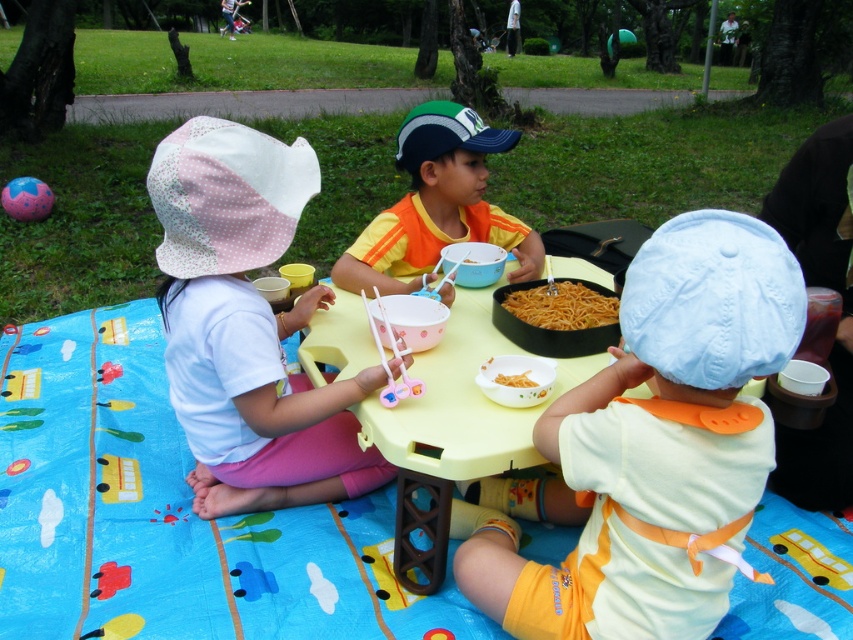
Based on the photo, does blue fabric picnic blanket at center have a greater height compared to yellow plastic table at center?

Indeed, blue fabric picnic blanket at center has a greater height compared to yellow plastic table at center.

Find the location of `blue fabric picnic blanket at center`. blue fabric picnic blanket at center is located at coordinates (169, 515).

Is point (140, 481) more distant than point (428, 356)?

Yes, it is behind point (428, 356).

You are a GUI agent. You are given a task and a screenshot of the screen. Output one action in this format:
    pyautogui.click(x=<x>, y=<y>)
    Task: Click on the blue fabric picnic blanket at center
    Image resolution: width=853 pixels, height=640 pixels.
    Given the screenshot: What is the action you would take?
    pyautogui.click(x=169, y=515)

Can you confirm if orange fabric shirt at center is bigger than brown matte noodles at center?

Yes.

Is point (398, 212) in front of point (555, 284)?

No.

The height and width of the screenshot is (640, 853). Identify the location of orange fabric shirt at center. (437, 204).

Between point (480, 625) and point (695, 493), which one is positioned behind?

Point (480, 625)

Does blue fabric picnic blanket at center have a larger size compared to white fabric bib at center?

Yes, blue fabric picnic blanket at center is bigger than white fabric bib at center.

Describe the element at coordinates (169, 515) in the screenshot. The width and height of the screenshot is (853, 640). I see `blue fabric picnic blanket at center` at that location.

Locate an element on the screen. This screenshot has height=640, width=853. blue fabric picnic blanket at center is located at coordinates (169, 515).